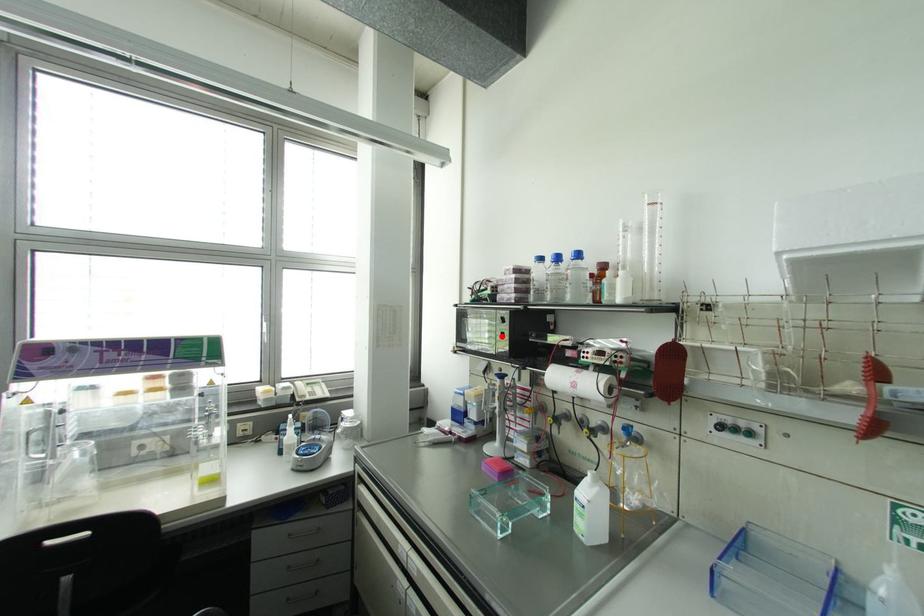
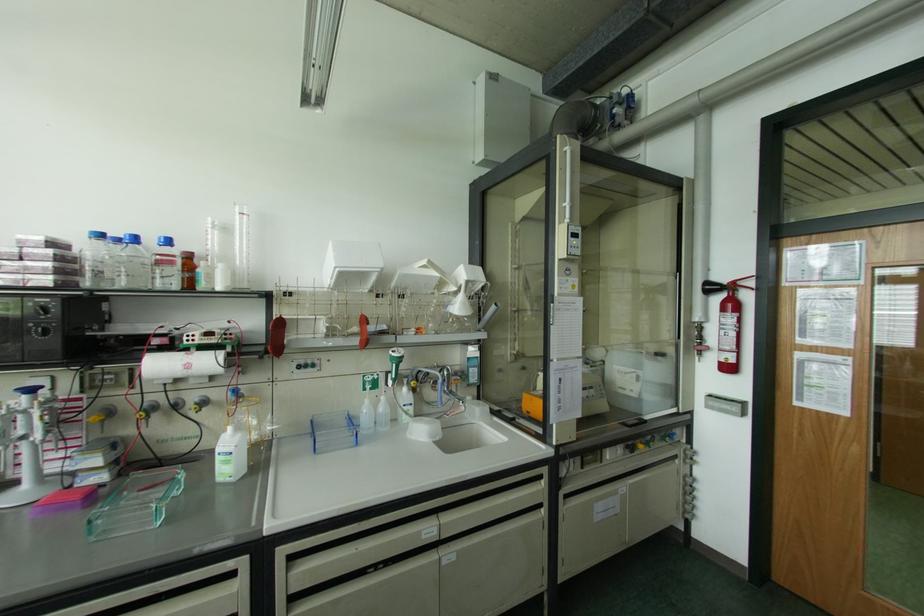
Find the pixel in the second image that matches the highlighted location in the first image.

(44, 333)